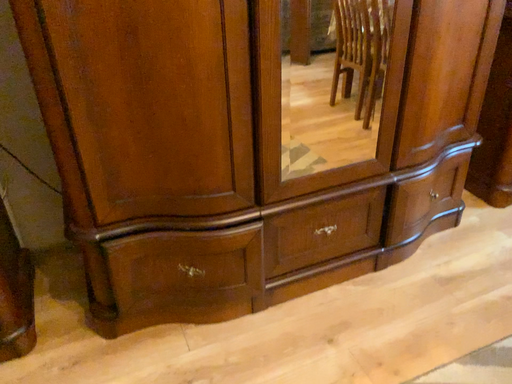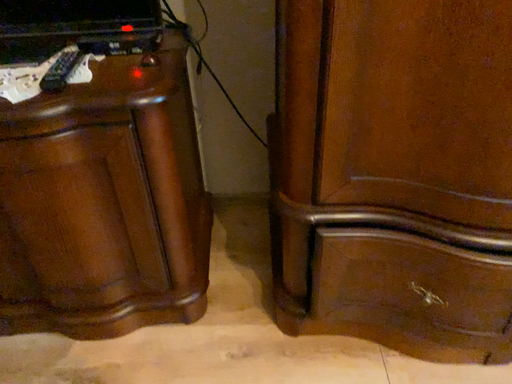
Question: How did the camera likely rotate when shooting the video?

Choices:
 (A) rotated left
 (B) rotated right

Answer: (A)